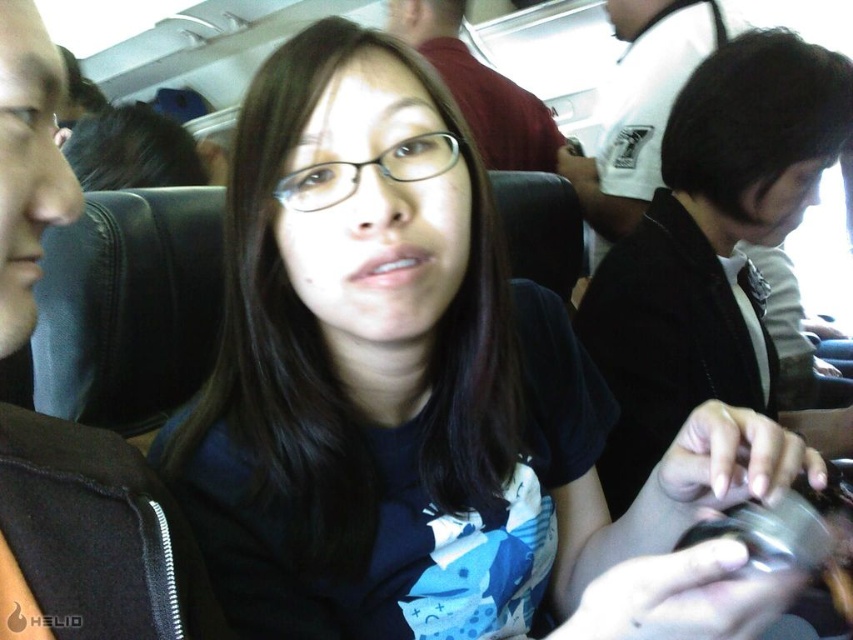
You are seated in the airplane cabin and need to determine which of the two jackets is narrower. You see the black fabric jacket at left and the black matte jacket at right. Which one has a smaller width?

The black fabric jacket at left has a lesser width compared to the black matte jacket at right, so the black fabric jacket at left is narrower.

You are sitting in an airplane seat and want to place a small item on the tray table in front of you. The tray table is located at point (22,84). If your hand is currently 10 inches away from the tray table, how much closer do you need to move your hand to reach it?

The distance between your hand and the tray table at point (22,84) is 10 inches, but the tray table is actually 12.30 inches away from you. To reach it, you need to move your hand 2.3 inches closer.